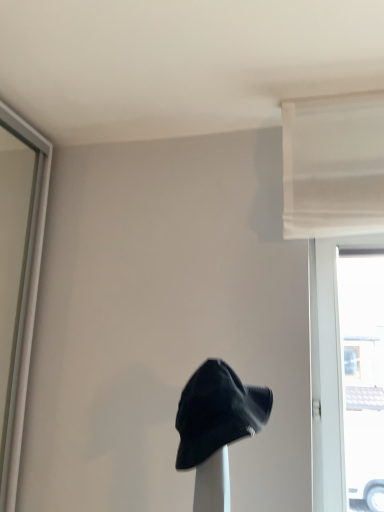
Locate an element on the screen. black fabric hat at center is located at coordinates (217, 412).

This screenshot has height=512, width=384. What do you see at coordinates (217, 412) in the screenshot?
I see `black fabric hat at center` at bounding box center [217, 412].

Where is `black fabric hat at center`? black fabric hat at center is located at coordinates (217, 412).